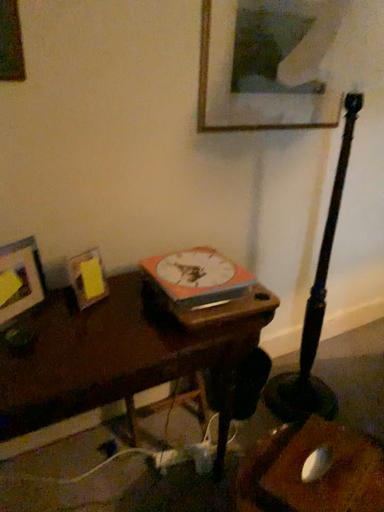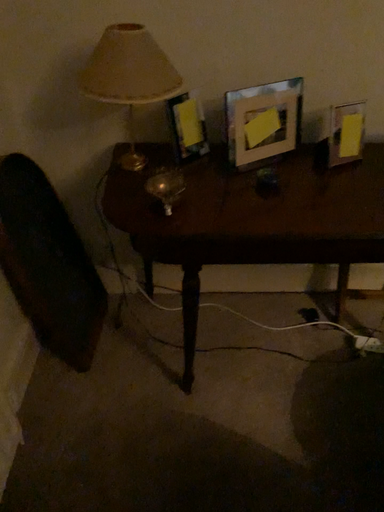
Question: Which way did the camera rotate in the video?

Choices:
 (A) rotated downward
 (B) rotated upward

Answer: (A)